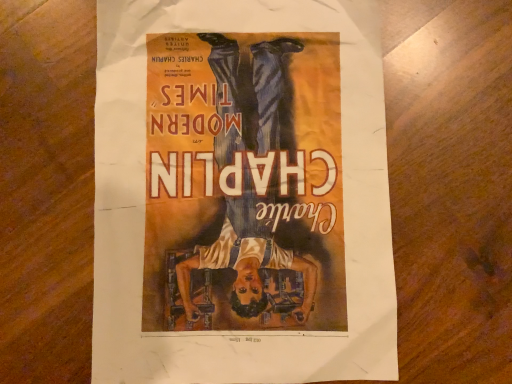
This screenshot has width=512, height=384. What are the coordinates of `free space above matte paper poster at center (from a real-world perspective)` in the screenshot? It's located at (245, 162).